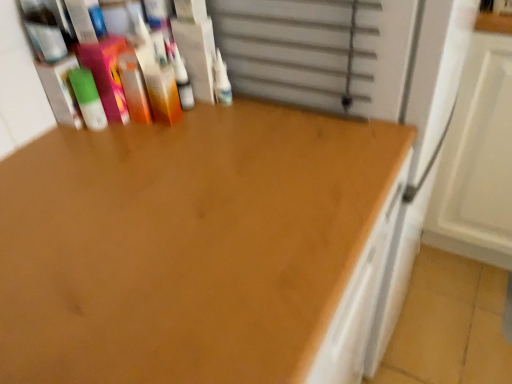
The height and width of the screenshot is (384, 512). Find the location of `empty space that is ontop of wooden table at center (from a real-world perspective)`. empty space that is ontop of wooden table at center (from a real-world perspective) is located at coordinates (172, 198).